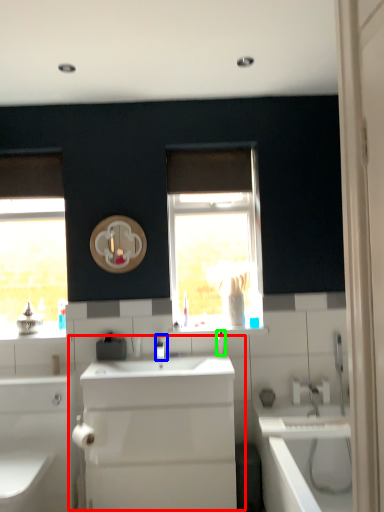
Question: Which object is positioned closest to sink (highlighted by a red box)? Select from tap (highlighted by a blue box) and toiletry (highlighted by a green box).

Choices:
 (A) tap
 (B) toiletry

Answer: (A)